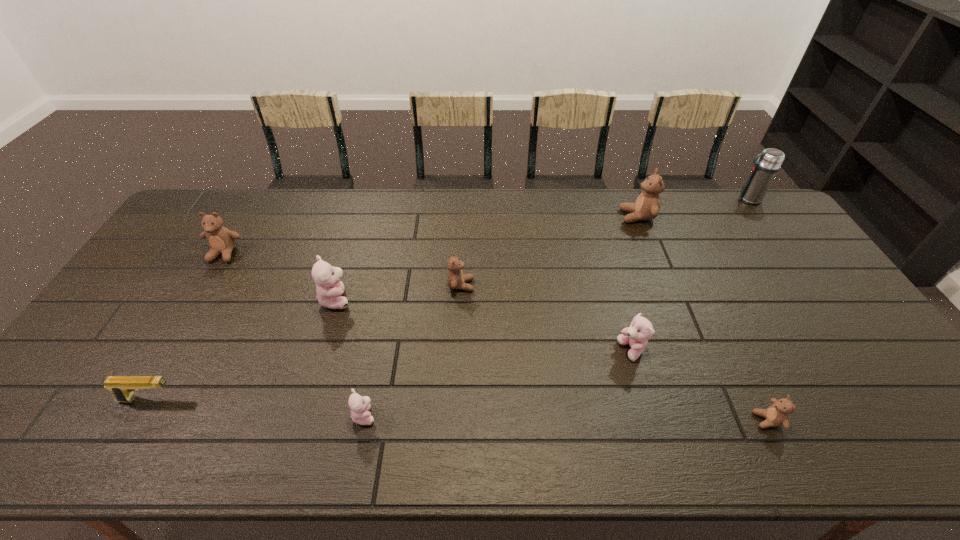
Locate an element on the screen. the closest pink teddy bear to the nearest brown teddy bear is located at coordinates (641, 330).